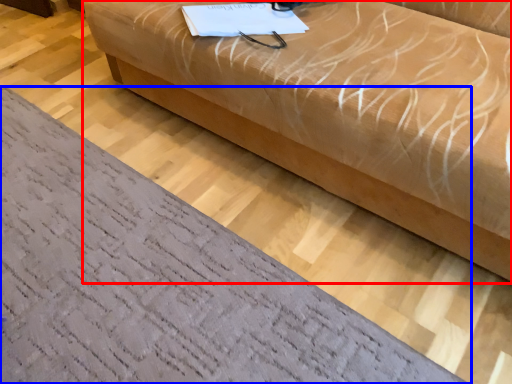
Question: Which object is further to the camera taking this photo, studio couch (highlighted by a red box) or furniture (highlighted by a blue box)?

Choices:
 (A) studio couch
 (B) furniture

Answer: (B)